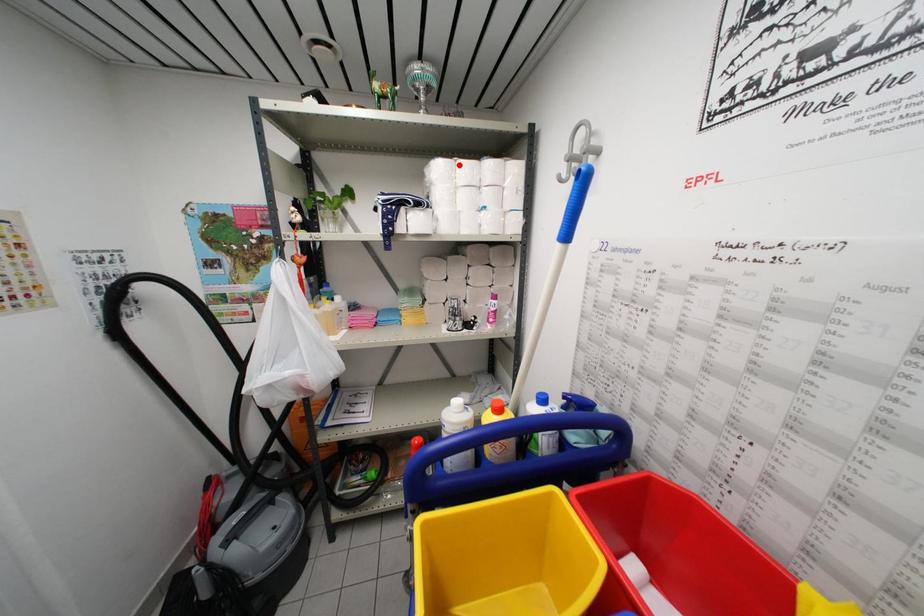
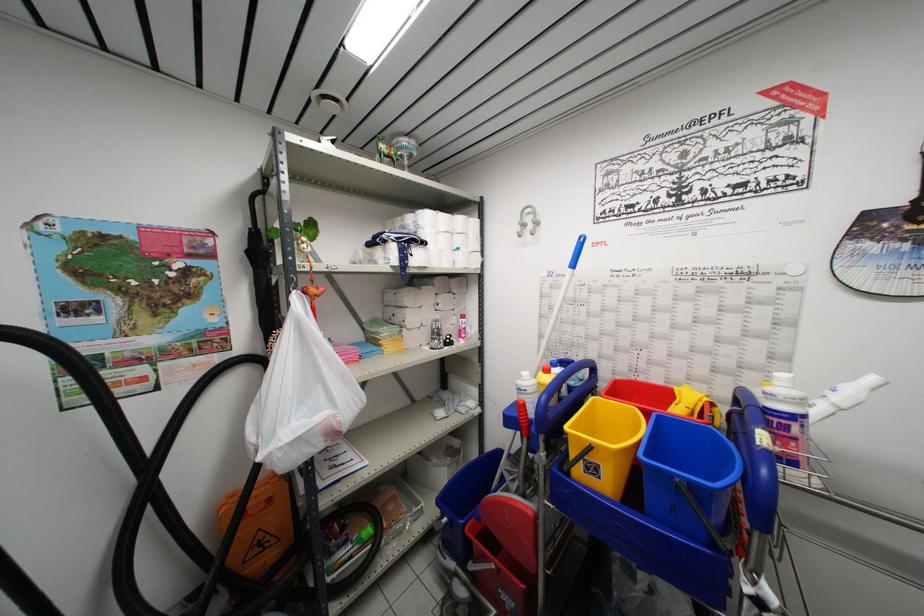
Locate, in the second image, the point that corresponds to the highlighted location in the first image.

(441, 217)